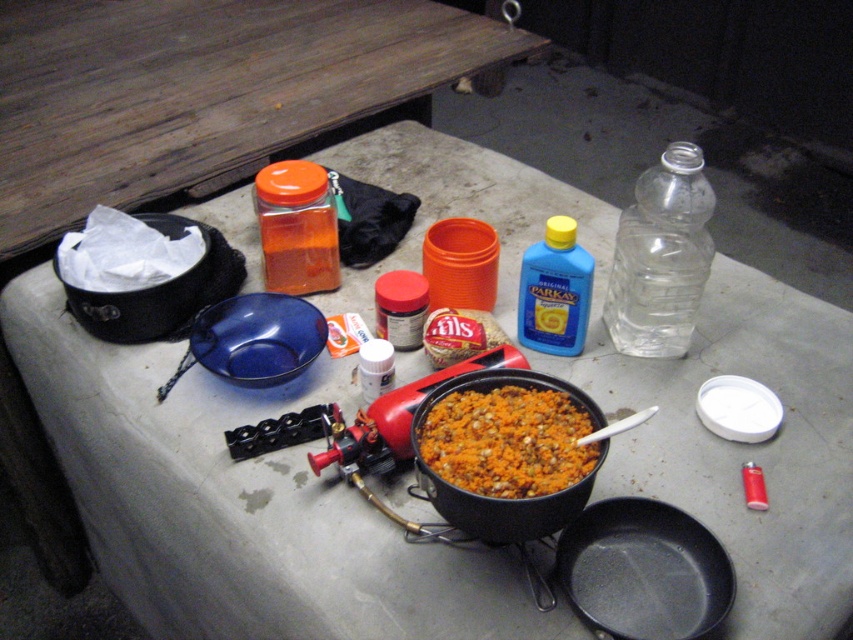
Question: Estimate the real-world distances between objects in this image. Which object is farther from the brown matte pot at center?

Choices:
 (A) black non-stick frying pan at lower center
 (B) orange matte jar at center
 (C) transparent plastic bottle at upper right
 (D) smooth brown bread at center

Answer: (B)

Question: Is black non-stick frying pan at lower center bigger than transparent plastic bottle at upper right?

Choices:
 (A) no
 (B) yes

Answer: (A)

Question: Does transparent plastic bottle at upper right come in front of brown matte pot at center?

Choices:
 (A) no
 (B) yes

Answer: (A)

Question: Which point is farther to the camera?

Choices:
 (A) (440, 364)
 (B) (538, 440)
 (C) (279, 259)

Answer: (C)

Question: Does transparent plastic bottle at upper right come in front of orange matte jar at center?

Choices:
 (A) yes
 (B) no

Answer: (A)

Question: Which object is closer to the camera taking this photo?

Choices:
 (A) transparent plastic bottle at upper right
 (B) black non-stick frying pan at lower center

Answer: (B)